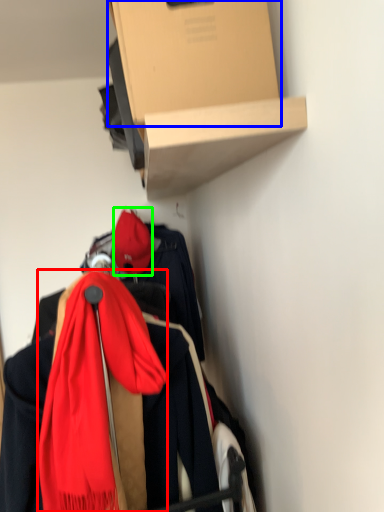
Question: Estimate the real-world distances between objects in this image. Which object is closer to scarf (highlighted by a red box), cardboard box (highlighted by a blue box) or hat (highlighted by a green box)?

Choices:
 (A) cardboard box
 (B) hat

Answer: (A)